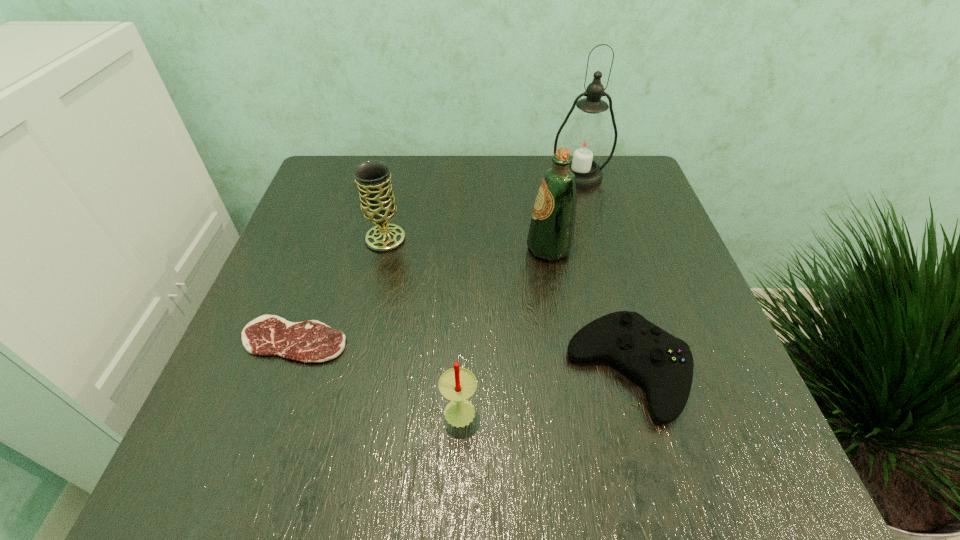
The width and height of the screenshot is (960, 540). Identify the location of vacant space situated on the front-facing side of the second tallest object. (480, 248).

Find the location of a particular element. Image resolution: width=960 pixels, height=540 pixels. vacant space located on the front-facing side of the second tallest object is located at coordinates (503, 248).

You are a GUI agent. You are given a task and a screenshot of the screen. Output one action in this format:
    pyautogui.click(x=<x>, y=<y>)
    Task: Click on the blank area located 0.120m on the right of the chalice
    
    Given the screenshot: What is the action you would take?
    pyautogui.click(x=459, y=239)

Where is `vacant space located 0.290m on the right of the third object from left to right`? vacant space located 0.290m on the right of the third object from left to right is located at coordinates (660, 409).

At what (x,y) coordinates should I click in order to perform the action: click on vacant region located 0.300m on the left of the control. Please return your answer as a coordinate pair (x, y). Looking at the image, I should click on (392, 371).

Locate an element on the screen. free spot located 0.290m on the right of the shortest object is located at coordinates coord(509,340).

The height and width of the screenshot is (540, 960). Identify the location of object situated at the far edge. (586, 139).

Where is `object that is at the near edge`? The image size is (960, 540). object that is at the near edge is located at coordinates 457,384.

Find the location of a particular element. The width and height of the screenshot is (960, 540). object that is at the left edge is located at coordinates (309, 341).

I want to click on oil lamp at the right edge, so click(586, 139).